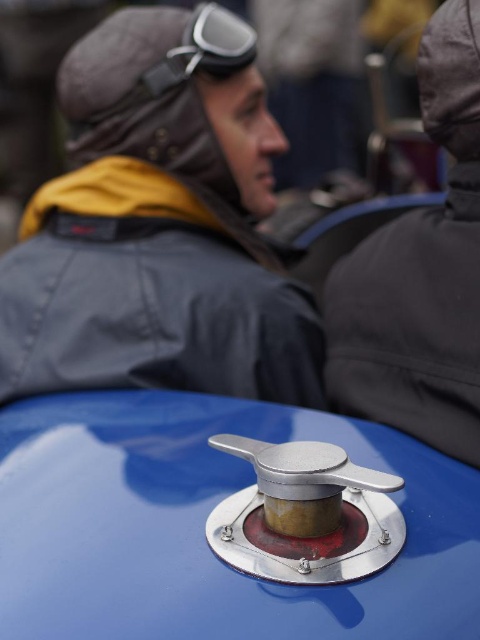
Question: Which of the following is the closest to the observer?

Choices:
 (A) (420, 499)
 (B) (453, 241)
 (C) (159, 81)

Answer: (A)

Question: Is shiny metallic knob at center positioned in front of matte gray goggles at upper center?

Choices:
 (A) no
 (B) yes

Answer: (B)

Question: Can you confirm if matte gray helmet at upper left is positioned to the right of matte gray goggles at upper center?

Choices:
 (A) no
 (B) yes

Answer: (A)

Question: Which point is farther from the camera taking this photo?

Choices:
 (A) (474, 48)
 (B) (1, 344)
 (C) (68, 630)

Answer: (B)

Question: Which of these objects is positioned farthest from the matte gray goggles at upper center?

Choices:
 (A) dark gray jacket at center
 (B) matte gray helmet at upper left

Answer: (A)

Question: Can you confirm if shiny metallic knob at center is positioned to the left of dark gray jacket at center?

Choices:
 (A) no
 (B) yes

Answer: (B)